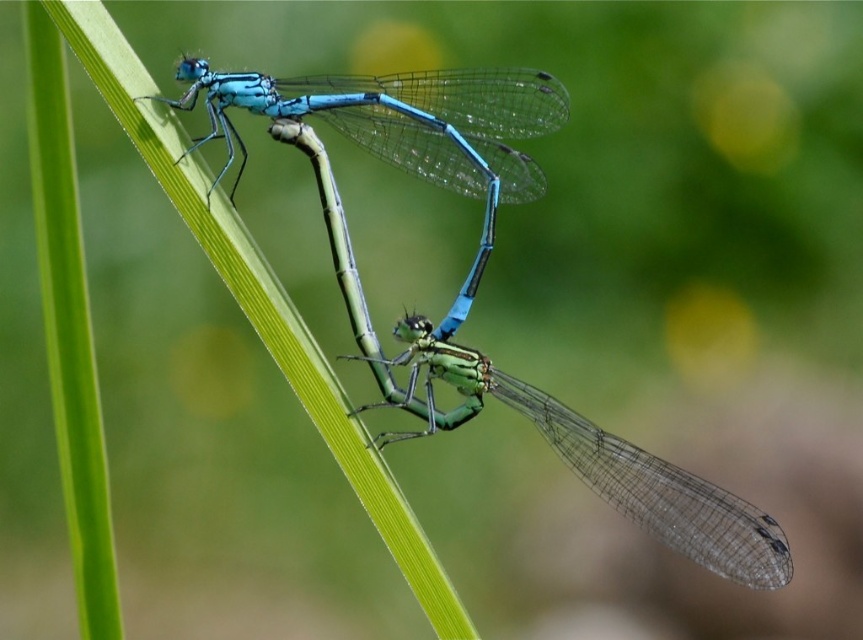
Does translucent glass dragonfly at center have a greater width compared to matte blue dragonfly at upper center?

Yes, translucent glass dragonfly at center is wider than matte blue dragonfly at upper center.

Between translucent glass dragonfly at center and matte blue dragonfly at upper center, which one has less height?

With less height is matte blue dragonfly at upper center.

Who is more forward, (578, 435) or (499, 99)?

Point (578, 435) is in front.

Find the location of a particular element. translucent glass dragonfly at center is located at coordinates (550, 422).